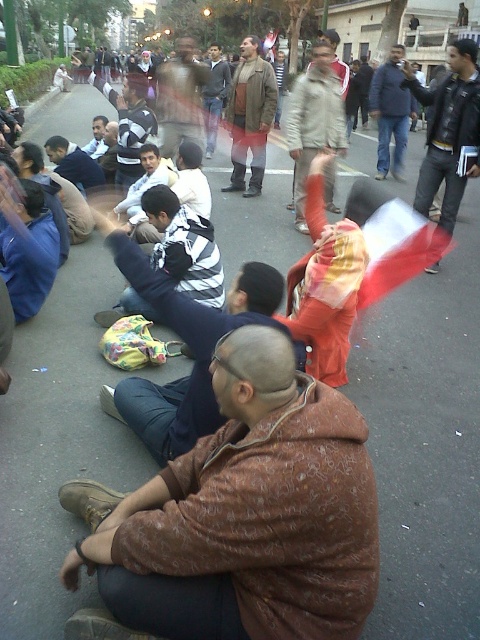
Which is in front, point (303, 186) or point (223, 189)?

Positioned in front is point (303, 186).

Does point (300, 100) come closer to viewer compared to point (240, 154)?

Yes, point (300, 100) is closer to viewer.

Identify the location of light beige jacket at center. (313, 120).

You are a GUI agent. You are given a task and a screenshot of the screen. Output one action in this format:
    pyautogui.click(x=<x>, y=<y>)
    Task: Click on the light beige jacket at center
    The width and height of the screenshot is (480, 640).
    Given the screenshot: What is the action you would take?
    pyautogui.click(x=313, y=120)

Is the position of leather jacket at upper right more distant than that of matte brown jacket at center?

No, it is not.

Does point (420, 179) come behind point (188, 56)?

No, (420, 179) is in front of (188, 56).

You are a GUI agent. You are given a task and a screenshot of the screen. Output one action in this format:
    pyautogui.click(x=<x>, y=<y>)
    Task: Click on the leather jacket at upper right
    This screenshot has height=640, width=480.
    Given the screenshot: What is the action you would take?
    pos(448,131)

Which is in front, point (203, 237) or point (85, 145)?

Point (203, 237) is in front.

Between striped fabric shirt at center and matte black shirt at center, which one has more height?

striped fabric shirt at center

Locate an element on the screen. The height and width of the screenshot is (640, 480). striped fabric shirt at center is located at coordinates pyautogui.click(x=184, y=248).